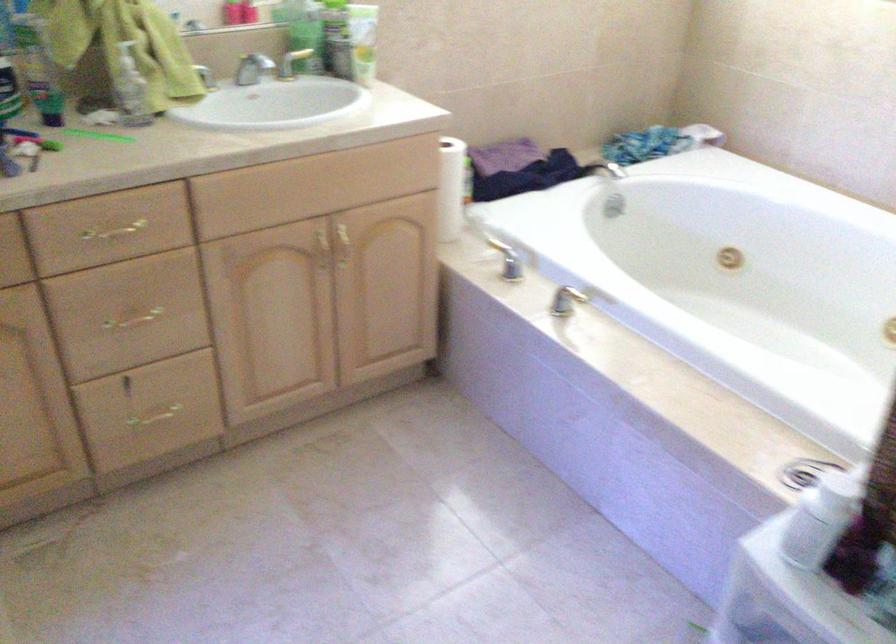
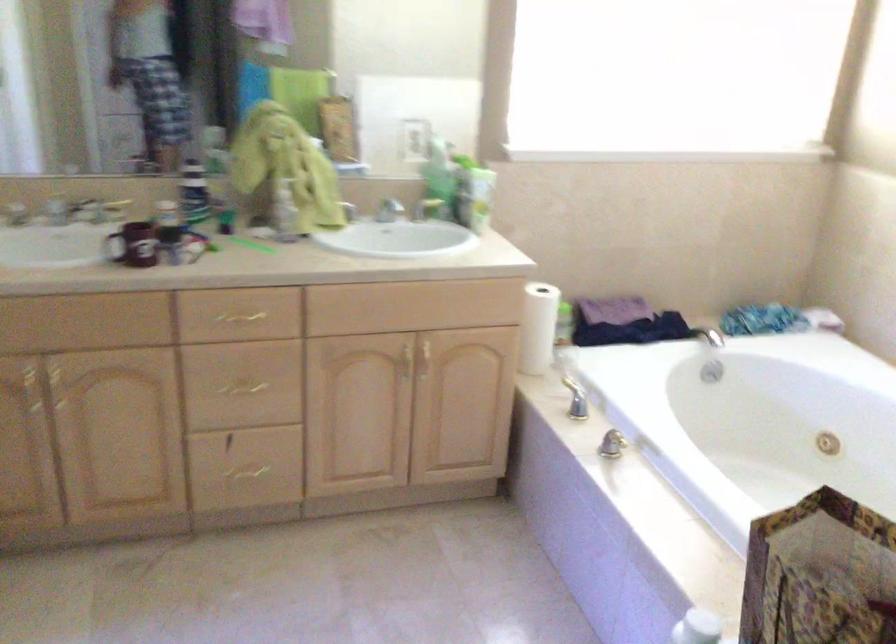
Locate, in the second image, the point that corresponds to point (121, 232) in the first image.

(244, 317)